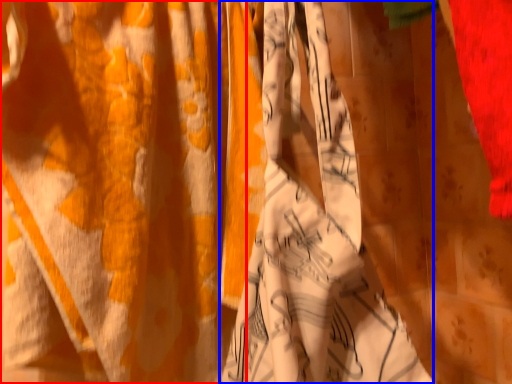
Question: Which of the following is the closest to the observer, curtain (highlighted by a red box) or clothing (highlighted by a blue box)?

Choices:
 (A) curtain
 (B) clothing

Answer: (B)